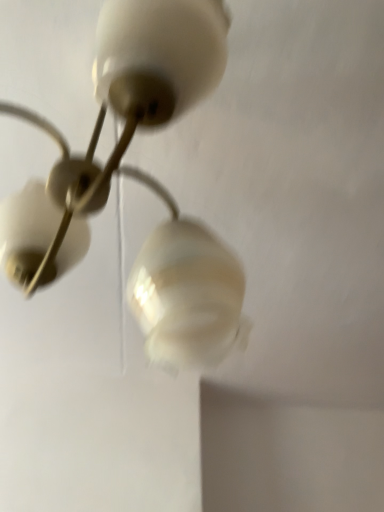
What are the coordinates of `matte white lamp at upper center` in the screenshot? It's located at (144, 181).

Describe the element at coordinates (144, 181) in the screenshot. The image size is (384, 512). I see `matte white lamp at upper center` at that location.

Where is `matte white lamp at upper center`? This screenshot has width=384, height=512. matte white lamp at upper center is located at coordinates (144, 181).